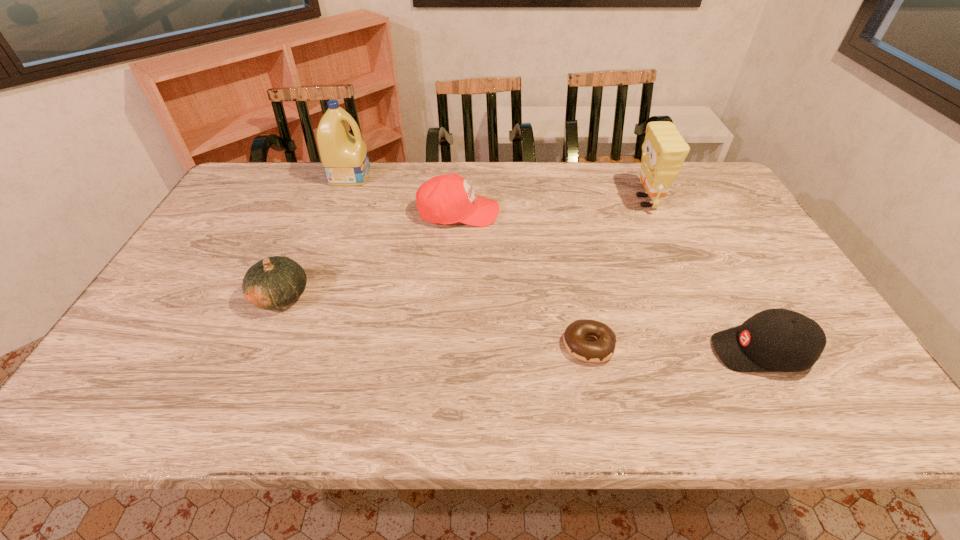
Locate an element on the screen. This screenshot has width=960, height=540. vacant region between the detergent and the nearer baseball cap is located at coordinates (555, 264).

Find the location of a particular element. Image resolution: width=960 pixels, height=540 pixels. free spot between the fourth farthest object and the detergent is located at coordinates (316, 236).

Identify the location of blank region between the right baseball cap and the fourth object from right to left. The height and width of the screenshot is (540, 960). (610, 282).

Identify the location of free space that is in between the left baseball cap and the sponge. The width and height of the screenshot is (960, 540). (552, 207).

Where is `vacant area between the nearer baseball cap and the farther baseball cap`? Image resolution: width=960 pixels, height=540 pixels. vacant area between the nearer baseball cap and the farther baseball cap is located at coordinates (610, 282).

What are the coordinates of `empty space between the gourd and the left baseball cap` in the screenshot? It's located at (370, 254).

Locate an element on the screen. This screenshot has width=960, height=540. free spot between the detergent and the sponge is located at coordinates (497, 188).

The height and width of the screenshot is (540, 960). In order to click on free space between the third object from left to right and the right baseball cap in this screenshot , I will do `click(610, 282)`.

Where is `free space between the sponge and the farther baseball cap`? The height and width of the screenshot is (540, 960). free space between the sponge and the farther baseball cap is located at coordinates (552, 207).

Locate which object is the second closest to the detergent. Please provide its 2D coordinates. Your answer should be formatted as a tuple, i.e. [(x, y)], where the tuple contains the x and y coordinates of a point satisfying the conditions above.

[(275, 282)]